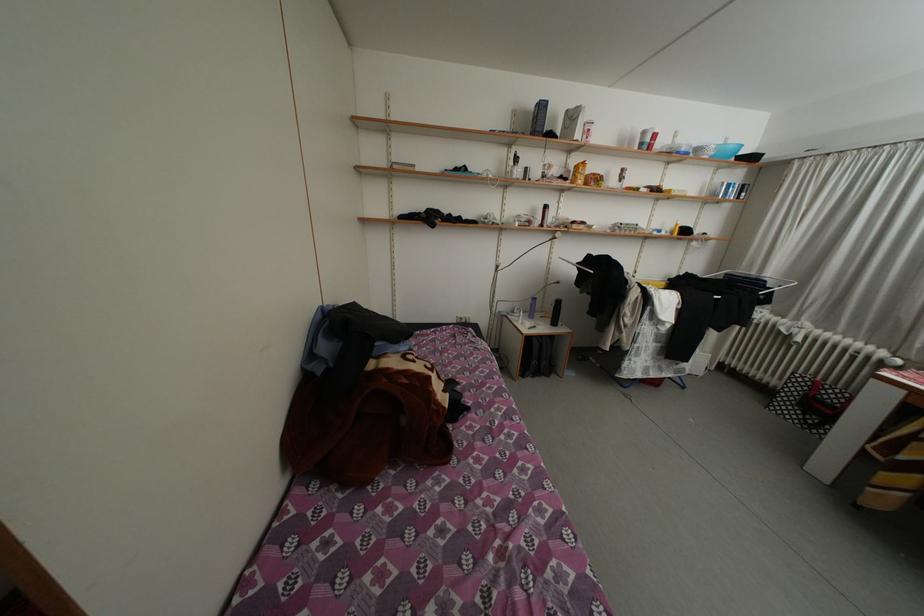
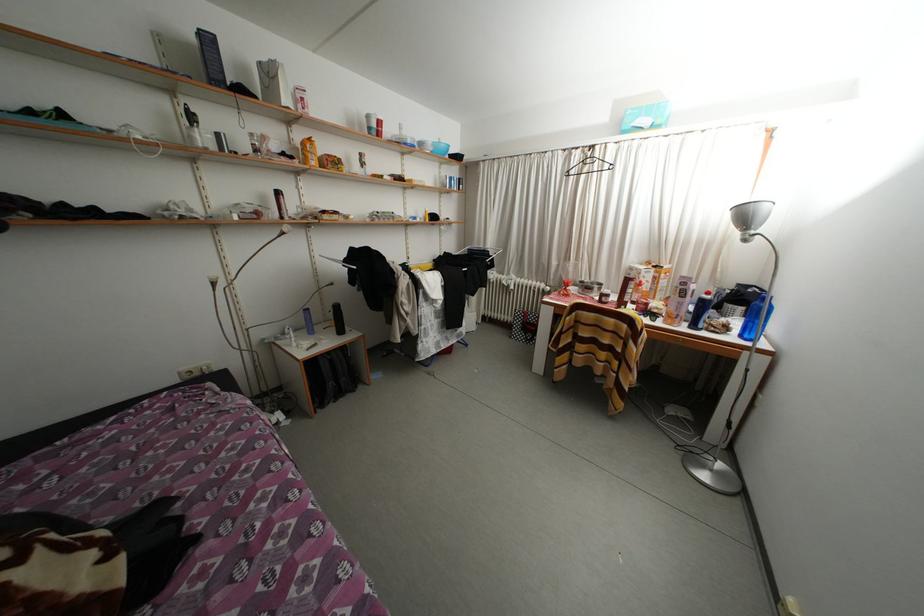
Question: The images are taken continuously from a first-person perspective. In which direction is your viewpoint rotating?

Choices:
 (A) Left
 (B) Right
 (C) Up
 (D) Down

Answer: (B)